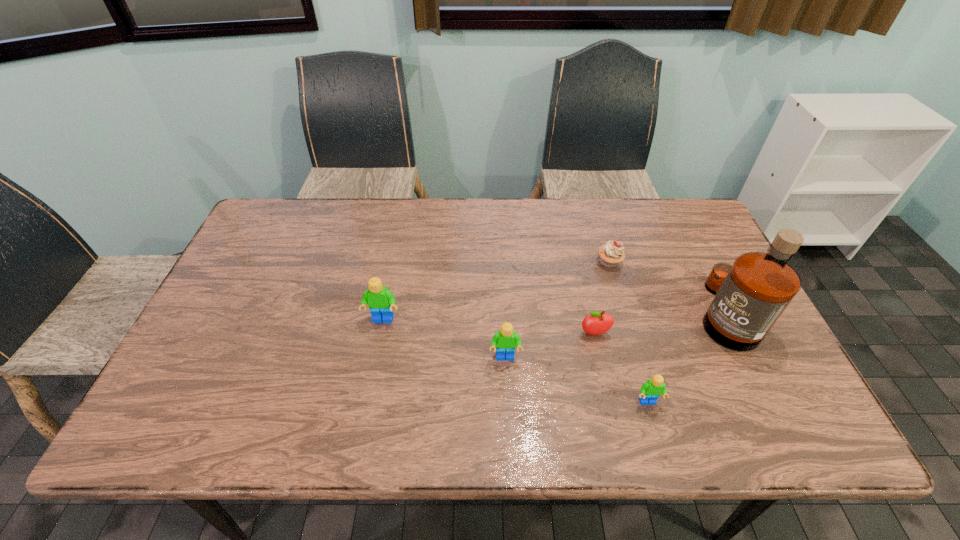
Where is `vacant space located on the face of the farthest Lego`? vacant space located on the face of the farthest Lego is located at coordinates (373, 370).

Image resolution: width=960 pixels, height=540 pixels. What are the coordinates of `vacant space located on the face of the second Lego from right to left` in the screenshot? It's located at (507, 394).

Identify the location of free space located 0.320m on the front of the farthest object. (639, 364).

Where is `free space located 0.060m on the front label of the rightmost object`? The height and width of the screenshot is (540, 960). free space located 0.060m on the front label of the rightmost object is located at coordinates coord(674,313).

Find the location of a particular element. This screenshot has width=960, height=540. vacant position located on the front label of the rightmost object is located at coordinates (592, 313).

This screenshot has height=540, width=960. What are the coordinates of `vacant space located on the front label of the rightmost object` in the screenshot? It's located at (585, 313).

In order to click on free region located on the back of the fourth object from right to left in this screenshot , I will do `click(572, 234)`.

The height and width of the screenshot is (540, 960). What are the coordinates of `object located at the near edge` in the screenshot? It's located at (650, 391).

At what (x,y) coordinates should I click in order to perform the action: click on object located in the right edge section of the desktop. Please return your answer as a coordinate pair (x, y). This screenshot has height=540, width=960. Looking at the image, I should click on (751, 294).

At what (x,y) coordinates should I click in order to perform the action: click on free space at the far edge of the desktop. Please return your answer as a coordinate pair (x, y). Image resolution: width=960 pixels, height=540 pixels. Looking at the image, I should click on (620, 214).